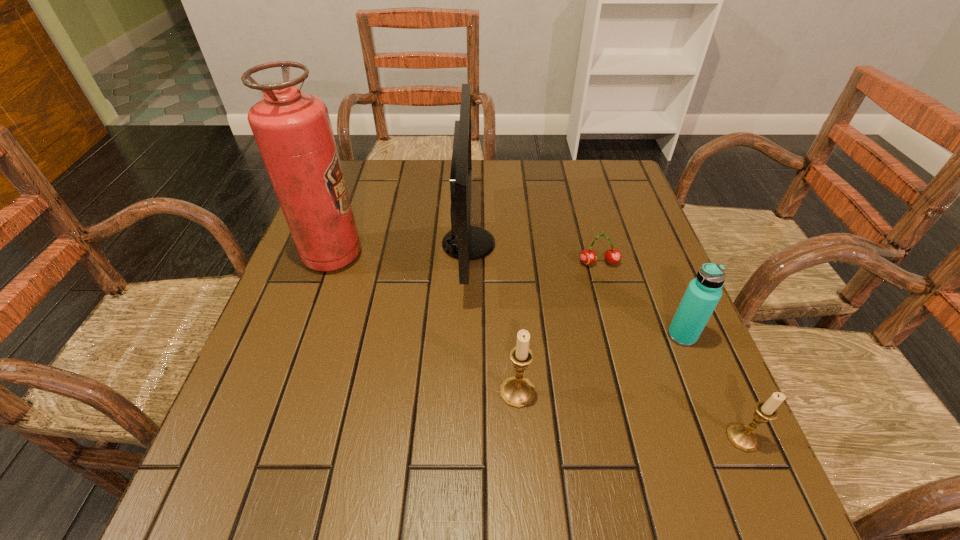
Find the location of a particular element. Image resolution: width=960 pixels, height=540 pixels. vacant space located 0.150m on the left of the taller candle holder is located at coordinates (420, 392).

Locate an element on the screen. vacant region located on the left of the shorter candle holder is located at coordinates (518, 437).

What are the coordinates of `free space located on the front-facing side of the computer monitor` in the screenshot? It's located at (602, 244).

Where is `vacant space located on the label side of the fire extinguisher`? The height and width of the screenshot is (540, 960). vacant space located on the label side of the fire extinguisher is located at coordinates (430, 255).

Identify the location of vacant area located 0.050m with stems pointing upwards on the cherry. (605, 284).

The image size is (960, 540). What are the coordinates of `blank space located 0.220m on the back of the fourth farthest object` in the screenshot? It's located at (650, 255).

At what (x,y) coordinates should I click in order to perform the action: click on object that is at the far edge. Please return your answer as a coordinate pair (x, y). Looking at the image, I should click on (464, 242).

Identify the location of object that is at the left edge. This screenshot has width=960, height=540. coord(292,129).

Where is `candle holder present at the right edge`? candle holder present at the right edge is located at coordinates (743, 437).

The image size is (960, 540). Find the location of `cherry that is positioned at the right edge`. cherry that is positioned at the right edge is located at coordinates (612, 256).